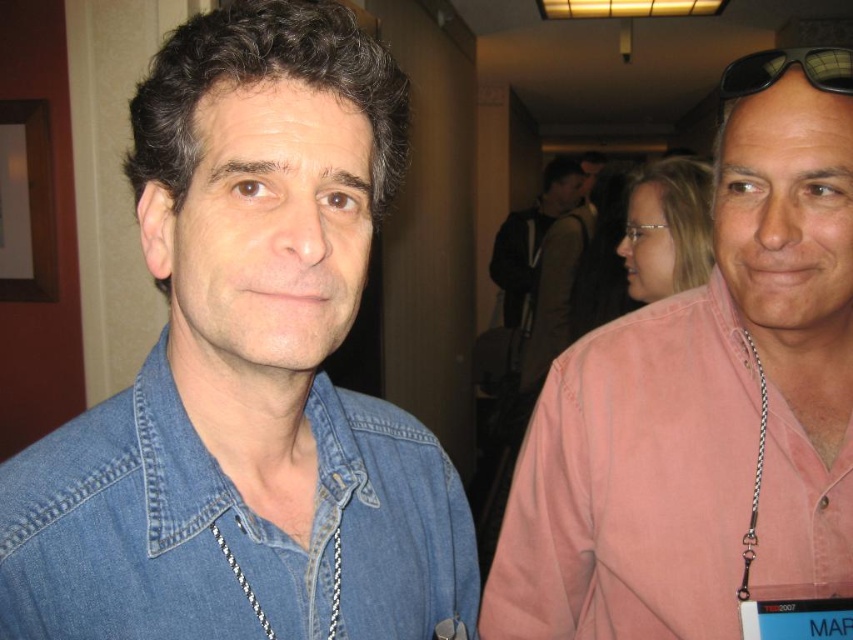
Question: Considering the relative positions of black plastic sunglasses at upper right and white braided cord at right in the image provided, where is black plastic sunglasses at upper right located with respect to white braided cord at right?

Choices:
 (A) left
 (B) right

Answer: (B)

Question: Is denim shirt at left bigger than white braided cord at right?

Choices:
 (A) yes
 (B) no

Answer: (A)

Question: Which of the following is the closest to the observer?

Choices:
 (A) black plastic sunglasses at upper right
 (B) silver chain necklace at center
 (C) pink cotton shirt at right
 (D) denim shirt at left

Answer: (D)

Question: Which object is positioned closest to the denim jacket at center?

Choices:
 (A) silver chain necklace at center
 (B) denim shirt at left
 (C) white braided cord at right

Answer: (B)

Question: Is pink cotton shirt at right to the left of denim shirt at left from the viewer's perspective?

Choices:
 (A) no
 (B) yes

Answer: (A)

Question: Among these objects, which one is nearest to the camera?

Choices:
 (A) white braided cord at right
 (B) black plastic sunglasses at upper right

Answer: (B)